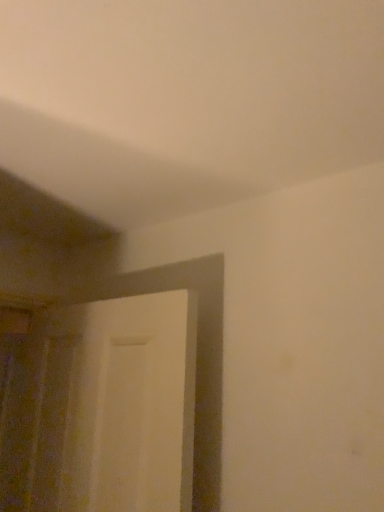
This screenshot has width=384, height=512. I want to click on white matte door at left, so click(x=132, y=403).

Image resolution: width=384 pixels, height=512 pixels. What do you see at coordinates (132, 403) in the screenshot? I see `white matte door at left` at bounding box center [132, 403].

Identify the location of white matte door at left. This screenshot has width=384, height=512. (132, 403).